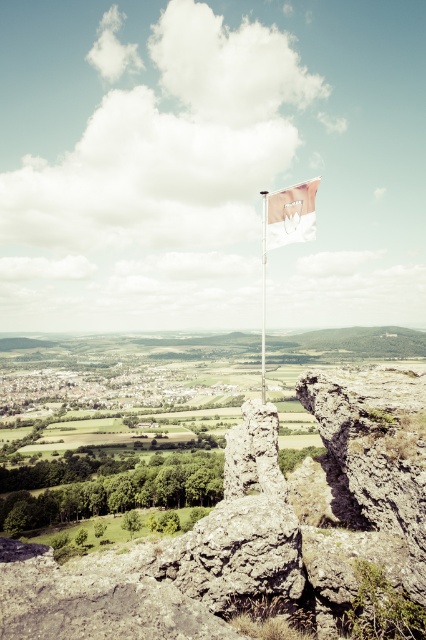
Question: Is rugged stone cliff at center to the right of white fabric flag at center from the viewer's perspective?

Choices:
 (A) yes
 (B) no

Answer: (B)

Question: Considering the relative positions of rugged stone cliff at center and metallic flag pole at center in the image provided, where is rugged stone cliff at center located with respect to metallic flag pole at center?

Choices:
 (A) above
 (B) below

Answer: (B)

Question: Which point is farther to the camera?

Choices:
 (A) (313, 189)
 (B) (354, 506)

Answer: (B)

Question: Which point is closer to the camera taking this photo?

Choices:
 (A) (293, 216)
 (B) (262, 220)

Answer: (A)

Question: Among these points, which one is farthest from the camera?

Choices:
 (A) (316, 547)
 (B) (284, 209)
 (C) (262, 257)

Answer: (C)

Question: Observing the image, what is the correct spatial positioning of rugged stone cliff at center in reference to metallic flag pole at center?

Choices:
 (A) above
 (B) below

Answer: (B)